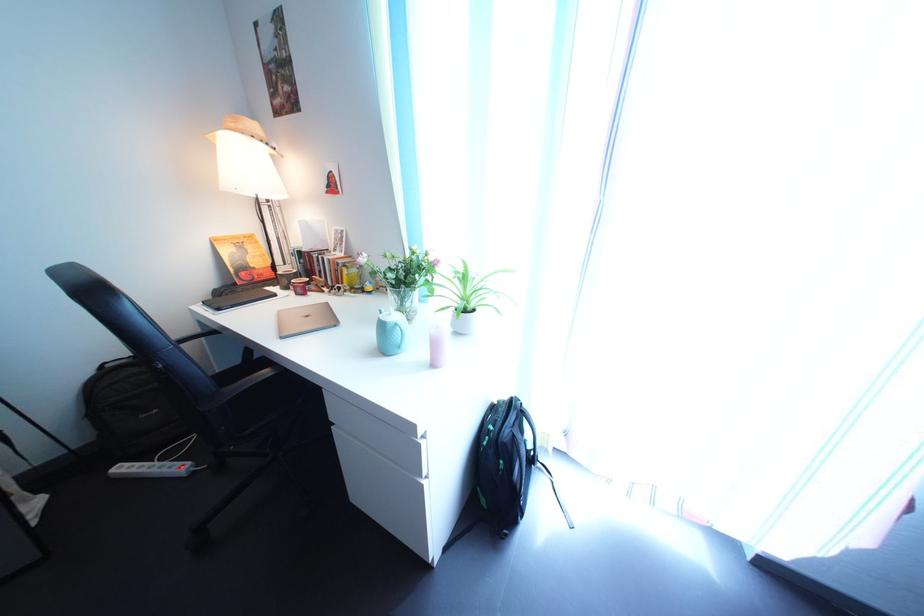
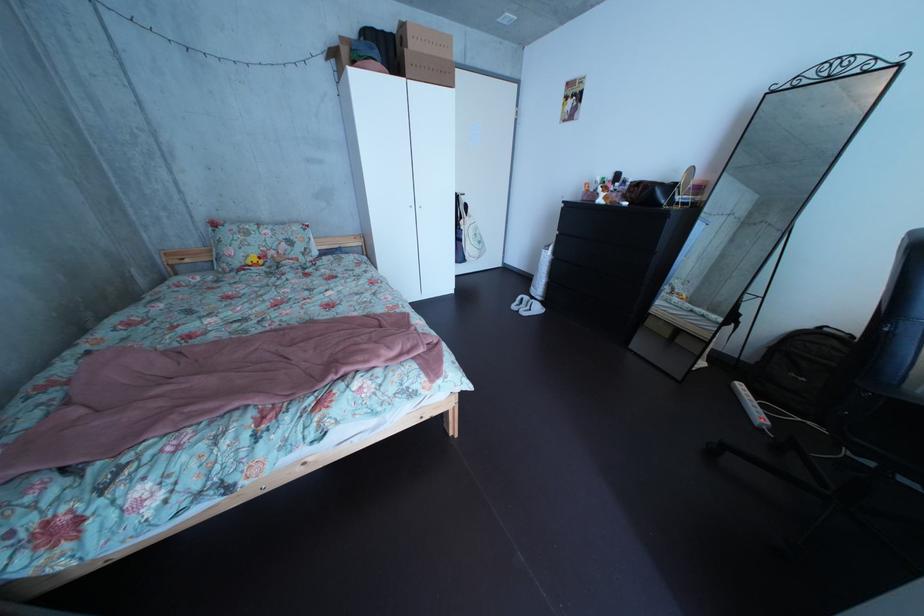
In the second image, find the point that corresponds to pixel 95 447 in the first image.

(763, 363)